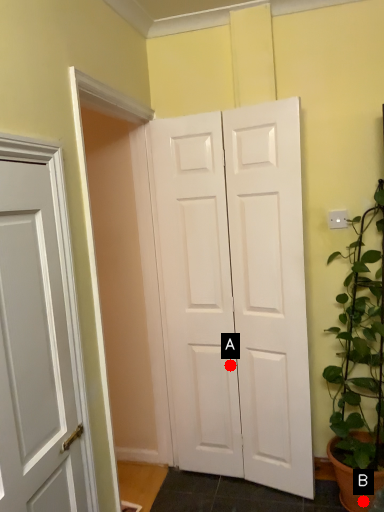
Question: Two points are circled on the image, labeled by A and B beside each circle. Which point is closer to the camera taking this photo?

Choices:
 (A) A is closer
 (B) B is closer

Answer: (B)